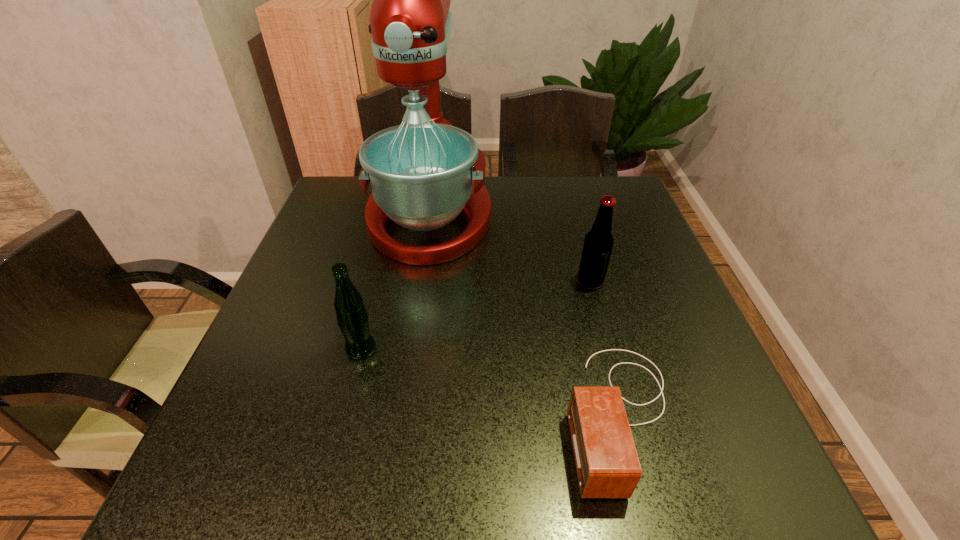
The width and height of the screenshot is (960, 540). Identify the location of free space located on the front-facing side of the radio receiver. (520, 415).

Image resolution: width=960 pixels, height=540 pixels. I want to click on vacant space situated 0.080m on the front-facing side of the radio receiver, so click(520, 415).

You are a GUI agent. You are given a task and a screenshot of the screen. Output one action in this format:
    pyautogui.click(x=<x>, y=<y>)
    Task: Click on the object located in the far edge section of the desktop
    
    Given the screenshot: What is the action you would take?
    pyautogui.click(x=424, y=173)

What are the coordinates of `object present at the near edge` in the screenshot? It's located at [x=607, y=465].

The height and width of the screenshot is (540, 960). Identify the location of object located at the left edge. (424, 173).

What are the coordinates of `object that is at the right edge` in the screenshot? It's located at (607, 465).

This screenshot has height=540, width=960. What are the coordinates of `object present at the far left corner` in the screenshot? It's located at (424, 173).

This screenshot has width=960, height=540. I want to click on object that is positioned at the near right corner, so click(607, 465).

Identify the location of free space at the left edge. This screenshot has width=960, height=540. 307,343.

At what (x,y) coordinates should I click in order to perform the action: click on vacant area at the right edge. Please return your answer as a coordinate pair (x, y). This screenshot has height=540, width=960. Looking at the image, I should click on (660, 252).